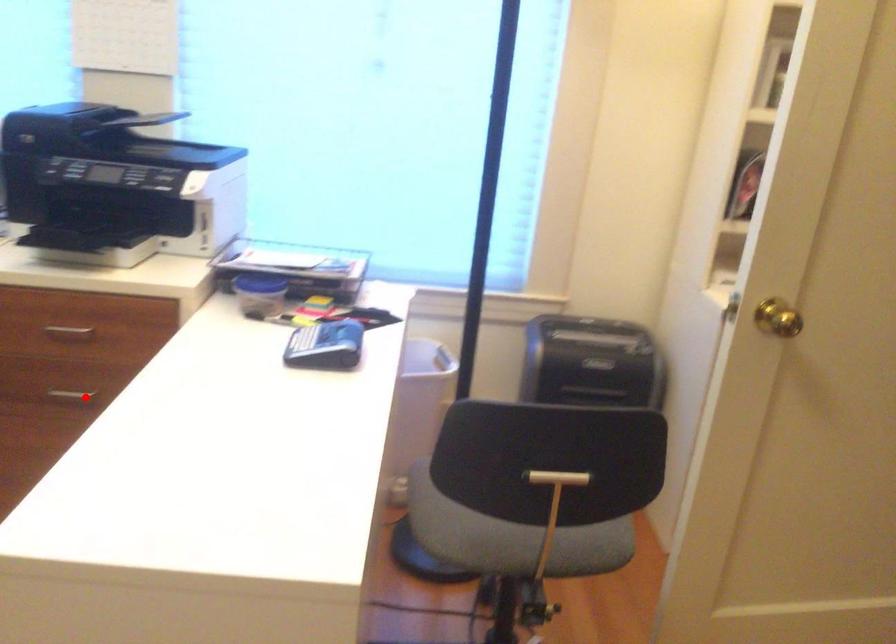
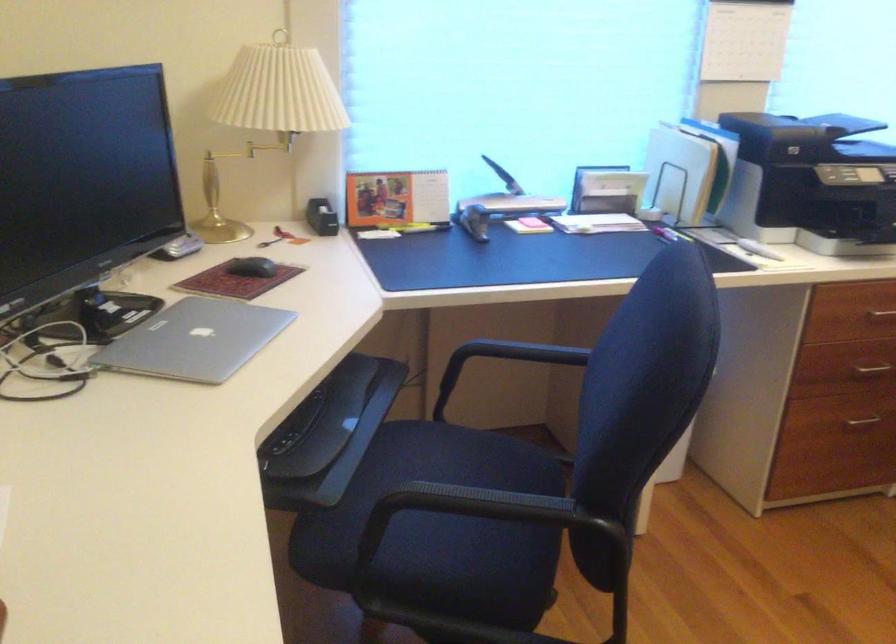
Question: I am providing you with two images of the same scene from different viewpoints. A red point is marked on the first image. At the location where the point appears in image 1, is it still visible in image 2?

Choices:
 (A) Yes
 (B) No

Answer: (A)